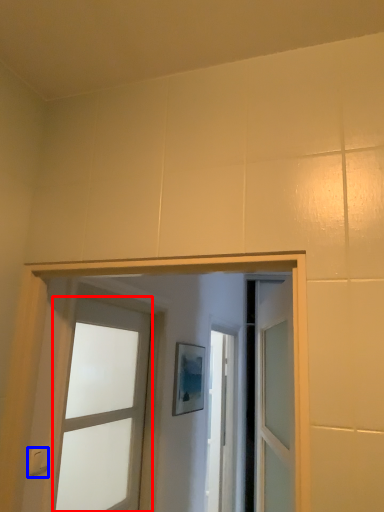
Question: Which object is closer to the camera taking this photo, door (highlighted by a red box) or light switch (highlighted by a blue box)?

Choices:
 (A) door
 (B) light switch

Answer: (B)